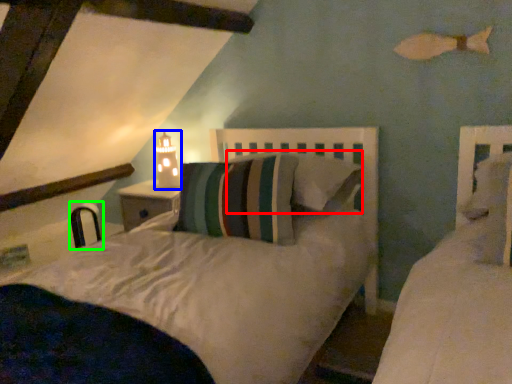
Question: Considering the real-world distances, which object is farthest from pillow (highlighted by a red box)? table lamp (highlighted by a blue box) or chair (highlighted by a green box)?

Choices:
 (A) table lamp
 (B) chair

Answer: (B)